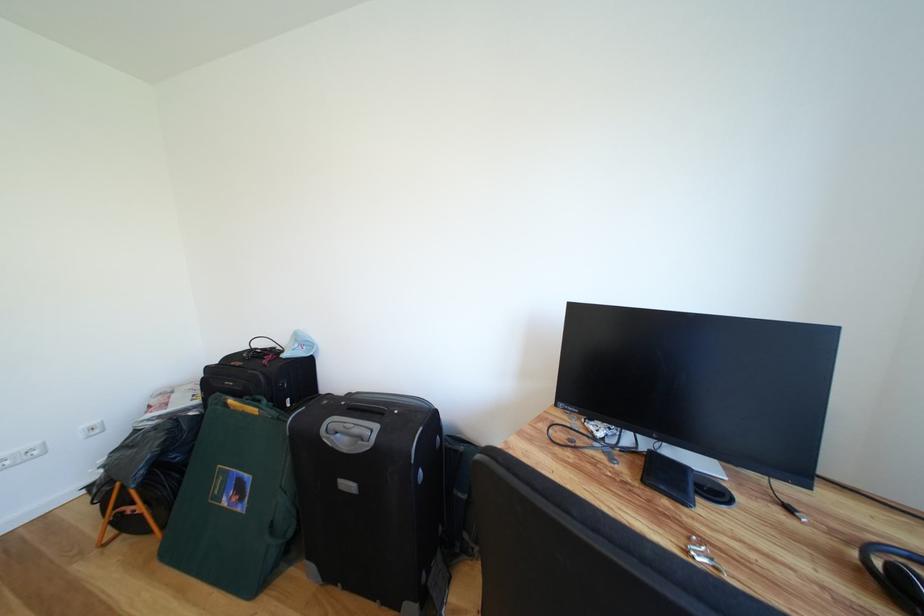
Locate an element on the screen. black fabric handle is located at coordinates (895, 573).